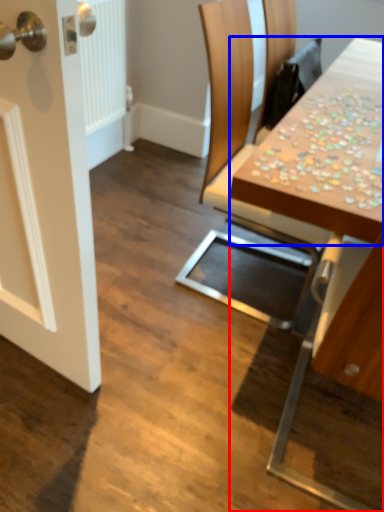
Question: Which point is further to the camera, table (highlighted by a red box) or counter top (highlighted by a blue box)?

Choices:
 (A) table
 (B) counter top

Answer: (B)